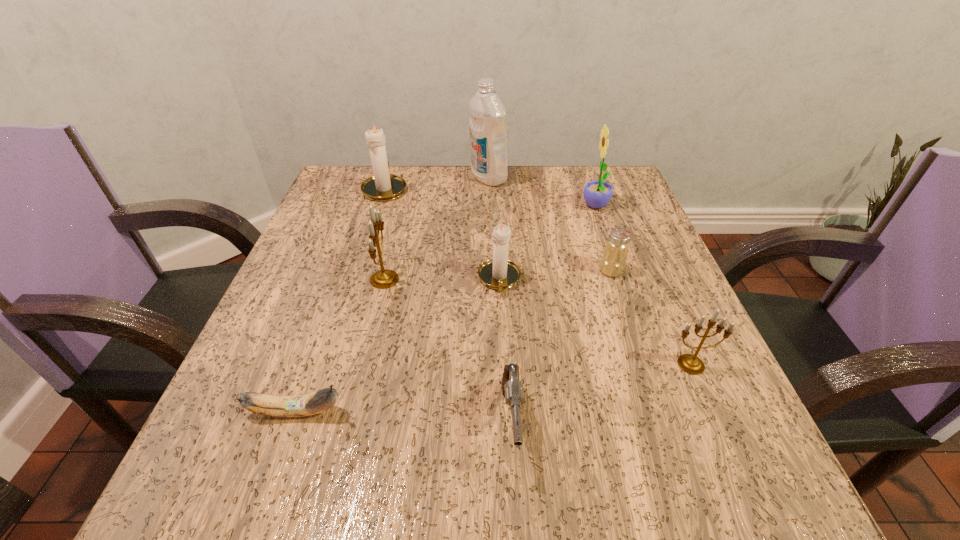
You are a GUI agent. You are given a task and a screenshot of the screen. Output one action in this format:
    pyautogui.click(x=<x>, y=<y>)
    Task: Click on the third closest object to the nearest candelabrum
    This screenshot has width=960, height=540.
    Given the screenshot: What is the action you would take?
    pyautogui.click(x=499, y=273)

At what (x,y) coordinates should I click in order to perform the action: click on object that is the fourth closest to the gray pistol. Please return your answer as a coordinate pair (x, y). Looking at the image, I should click on (384, 278).

At what (x,y) coordinates should I click in order to perform the action: click on the closest candelabrum to the bigger white candle holder. Please return your answer as a coordinate pair (x, y). Looking at the image, I should click on (384, 278).

The image size is (960, 540). What are the coordinates of `candelabrum object that ranks as the third closest to the sunflower` in the screenshot? It's located at (383, 186).

Locate an element on the screen. Image resolution: width=960 pixels, height=540 pixels. vacant area that satisfies the following two spatial constraints: 1. on the handle side of the bigger white candle holder; 2. on the right side of the white detergent is located at coordinates (389, 177).

This screenshot has height=540, width=960. Find the location of `vacant region that satisfies the following two spatial constraints: 1. on the front-facing side of the sunflower; 2. at the barrel of the pistol`. vacant region that satisfies the following two spatial constraints: 1. on the front-facing side of the sunflower; 2. at the barrel of the pistol is located at coordinates (672, 423).